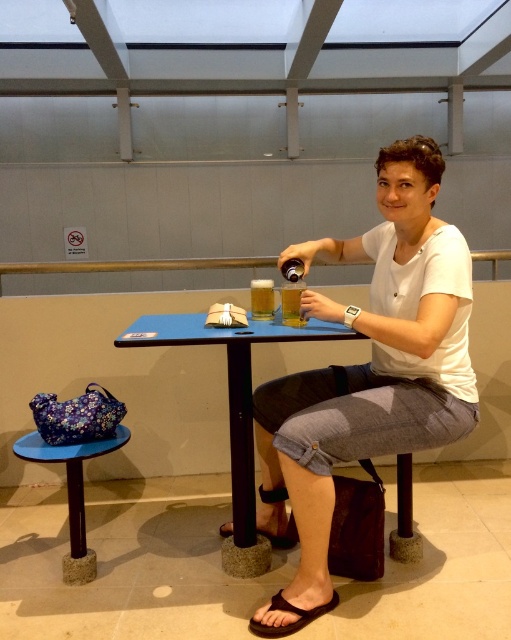
You are a delivery robot with a 1.5 meter long package. You need to place it on the blue plastic table at center. Can you reach the table from your current position without moving closer?

The blue plastic table at center is 1.61 meters away from the viewer. Since the package is 1.5 meters long, the robot can extend it to reach the table without moving closer.

You are a photographer trying to capture the scene from above. Since the white cotton shirt at center and the blue fabric table at lower left are both in the frame, which object will appear taller in the photo?

The white cotton shirt at center appears taller in the photo because it has a greater height compared to the blue fabric table at lower left according to the description.